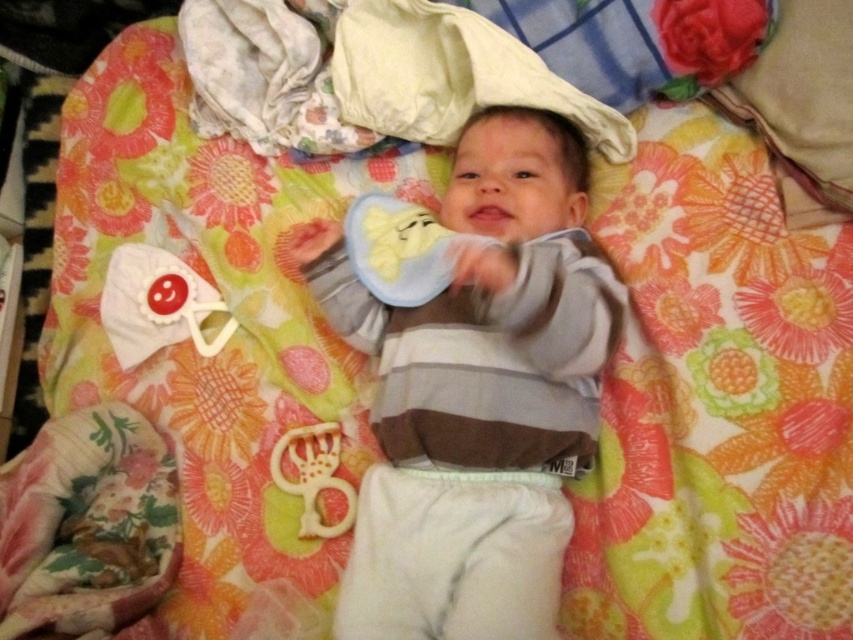
You are a parent trying to place a small toy between the white fabric pillow at upper center and the white plastic teething ring at lower center. The toy is 20 centimeters long. Will there be enough space between them to fit the toy?

The distance between the white fabric pillow at upper center and the white plastic teething ring at lower center is 52.25 centimeters. Since the toy is only 20 centimeters long, there is sufficient space to place it between them.

You are a parent trying to place a small rattle between the striped cotton onesie at center and the white fabric pillow at upper center. The rattle is 10 centimeters long. Is there enough space between them to place the rattle?

The striped cotton onesie at center is 25.26 centimeters from the white fabric pillow at upper center, so yes, there is enough space to place the 10 centimeter long rattle between them.

Based on the photo, please describe the position of the striped cotton onesie at center in terms of its coordinates within the image. The image has a coordinate system where the bottom left corner is the origin point. The x and y axes increase to the right and upwards respectively. You are to use the provided coordinates to answer this question.

The striped cotton onesie at center is located at coordinates x 0.619 and y 0.563 within the image.